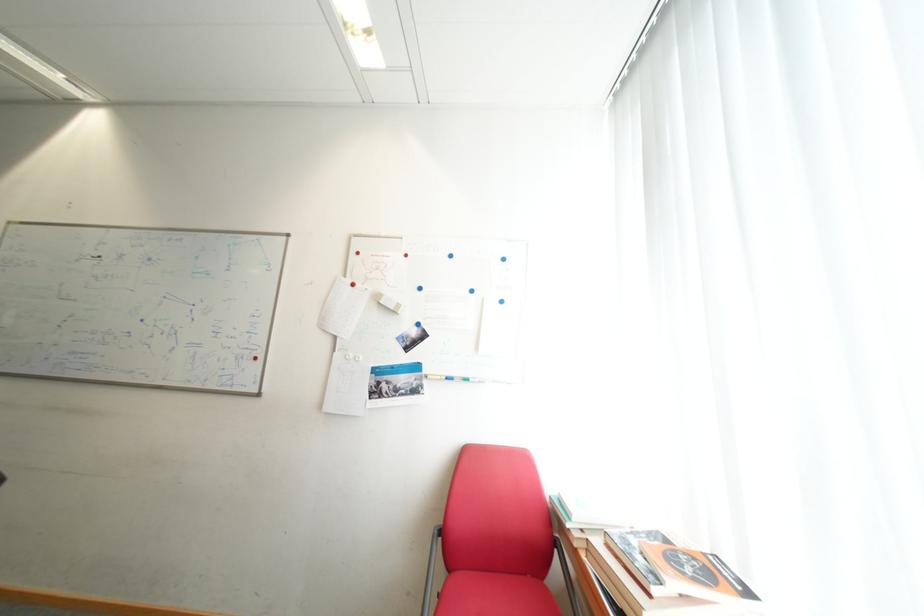
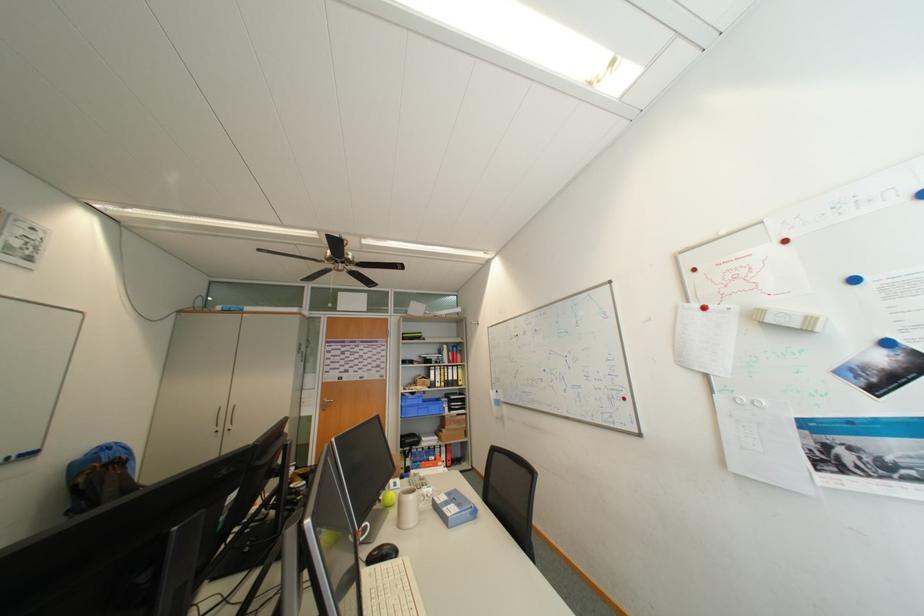
Find the pixel in the second image that matches point 391,302 in the first image.

(777, 322)